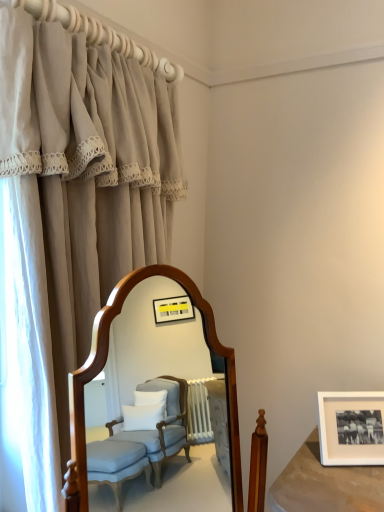
The height and width of the screenshot is (512, 384). What do you see at coordinates (78, 199) in the screenshot?
I see `beige fabric curtain at left` at bounding box center [78, 199].

Where is `beige fabric curtain at left`? beige fabric curtain at left is located at coordinates (78, 199).

What do you see at coordinates (351, 428) in the screenshot? The width and height of the screenshot is (384, 512). I see `white matte picture frame at lower right` at bounding box center [351, 428].

Where is `white matte picture frame at lower right`? This screenshot has height=512, width=384. white matte picture frame at lower right is located at coordinates (351, 428).

Identify the location of beige fabric curtain at left. (78, 199).

Is beige fabric curtain at left to the left or to the right of white matte picture frame at lower right in the image?

beige fabric curtain at left is to the left of white matte picture frame at lower right.

Does beige fabric curtain at left lie in front of white matte picture frame at lower right?

That is True.

Is point (177, 125) positioned behind point (379, 403)?

Yes.

From the image's perspective, is beige fabric curtain at left located above or below white matte picture frame at lower right?

beige fabric curtain at left is situated higher than white matte picture frame at lower right in the image.

From a real-world perspective, who is located higher, beige fabric curtain at left or white matte picture frame at lower right?

beige fabric curtain at left, from a real-world perspective.

From the picture: Considering the sizes of objects beige fabric curtain at left and white matte picture frame at lower right in the image provided, who is wider, beige fabric curtain at left or white matte picture frame at lower right?

beige fabric curtain at left.

Who is taller, beige fabric curtain at left or white matte picture frame at lower right?

beige fabric curtain at left is taller.

Who is bigger, beige fabric curtain at left or white matte picture frame at lower right?

With larger size is beige fabric curtain at left.

Which is correct: beige fabric curtain at left is inside white matte picture frame at lower right, or outside of it?

beige fabric curtain at left is located beyond the bounds of white matte picture frame at lower right.

Is beige fabric curtain at left not near white matte picture frame at lower right?

Yes.

Could you tell me if beige fabric curtain at left is turned towards white matte picture frame at lower right?

No, beige fabric curtain at left is not oriented towards white matte picture frame at lower right.

What's the angular difference between beige fabric curtain at left and white matte picture frame at lower right's facing directions?

The angular difference between beige fabric curtain at left and white matte picture frame at lower right is 34.8 degrees.

Image resolution: width=384 pixels, height=512 pixels. Identify the location of picture frame lying below the beige fabric curtain at left (from the image's perspective). (351, 428).

Between white matte picture frame at lower right and beige fabric curtain at left, which one appears on the right side from the viewer's perspective?

Positioned to the right is white matte picture frame at lower right.

Is white matte picture frame at lower right closer to camera compared to beige fabric curtain at left?

No.

Which point is more forward, (328,404) or (47,113)?

Point (47,113)

From the image's perspective, would you say white matte picture frame at lower right is positioned over beige fabric curtain at left?

Incorrect, from the image's perspective, white matte picture frame at lower right is lower than beige fabric curtain at left.

From a real-world perspective, which object rests below the other?

In real-world perspective, white matte picture frame at lower right is lower.

From the picture: Between white matte picture frame at lower right and beige fabric curtain at left, which one has larger width?

beige fabric curtain at left.

From their relative heights in the image, would you say white matte picture frame at lower right is taller or shorter than beige fabric curtain at left?

Considering their sizes, white matte picture frame at lower right has less height than beige fabric curtain at left.

Can you confirm if white matte picture frame at lower right is bigger than beige fabric curtain at left?

Actually, white matte picture frame at lower right might be smaller than beige fabric curtain at left.

Is beige fabric curtain at left surrounded by white matte picture frame at lower right?

No, beige fabric curtain at left is not surrounded by white matte picture frame at lower right.

Is there a large distance between white matte picture frame at lower right and beige fabric curtain at left?

Yes.

Is beige fabric curtain at left at the back of white matte picture frame at lower right?

No.

What's the angular difference between white matte picture frame at lower right and beige fabric curtain at left's facing directions?

There is a 34.8-degree angle between the facing directions of white matte picture frame at lower right and beige fabric curtain at left.

Measure the distance between white matte picture frame at lower right and beige fabric curtain at left.

A distance of 1.03 meters exists between white matte picture frame at lower right and beige fabric curtain at left.

You are a GUI agent. You are given a task and a screenshot of the screen. Output one action in this format:
    pyautogui.click(x=<x>, y=<y>)
    Task: Click on the curtain to the left of white matte picture frame at lower right
    The height and width of the screenshot is (512, 384).
    Given the screenshot: What is the action you would take?
    (78, 199)

Locate an element on the screen. picture frame that appears below the beige fabric curtain at left (from a real-world perspective) is located at coordinates (351, 428).

Locate an element on the screen. picture frame on the right of beige fabric curtain at left is located at coordinates (351, 428).